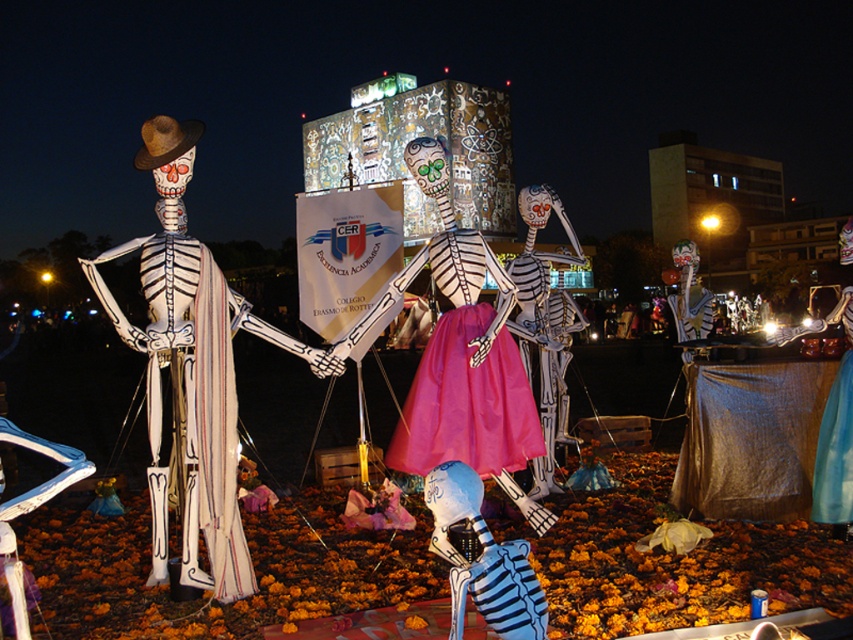
You are a photographer standing at the edge of the celebration area. You want to take a photo that includes both the white paper skeleton at left and the pink satin dress at center without moving either object. Given that your camera has a maximum focus range of 2.5 meters, will you be able to capture both subjects in focus?

The distance between the white paper skeleton at left and the pink satin dress at center is 2.58 meters. Since your camera can only focus up to 2.5 meters, you won

You are at a cultural festival and see the white paper skeleton at left and the blue fabric dress at center. Which object is positioned more to the east? Please answer based on the scene description.

The white paper skeleton at left is positioned to the left of the blue fabric dress at center. Since the scene is illuminated by artificial lighting at night, the direction of the light source can help determine orientation. Typically, in such scenes, the light source is from the front, so left would correspond to the east if facing the scene. Therefore, the white paper skeleton at left is more to the east.

You are a photographer at this event. You want to capture a photo where both the white paper skeleton at left and the pink satin dress at center are visible. Based on their positions, which one should be placed closer to the bottom of the photo to ensure both are in frame?

The white paper skeleton at left is above the pink satin dress at center, so to include both in the photo, the pink satin dress at center should be positioned closer to the bottom of the frame.